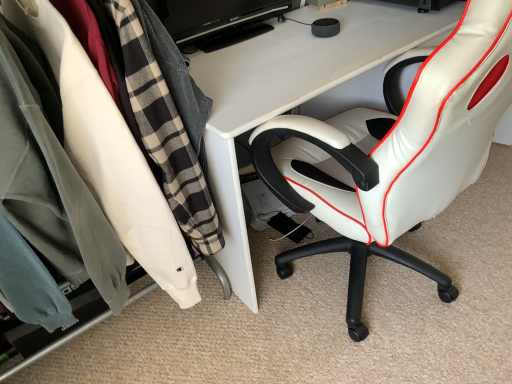
Question: Is point (169, 34) positioned closer to the camera than point (301, 132)?

Choices:
 (A) closer
 (B) farther

Answer: (B)

Question: Is black glossy monitor at upper center inside the boundaries of white leather chair at right, or outside?

Choices:
 (A) inside
 (B) outside

Answer: (B)

Question: Which object is the closest to the white leather chair at right?

Choices:
 (A) matte white clothing rack at left
 (B) black glossy monitor at upper center

Answer: (A)

Question: Which object is positioned closest to the white leather chair at right?

Choices:
 (A) black glossy monitor at upper center
 (B) matte white clothing rack at left

Answer: (B)